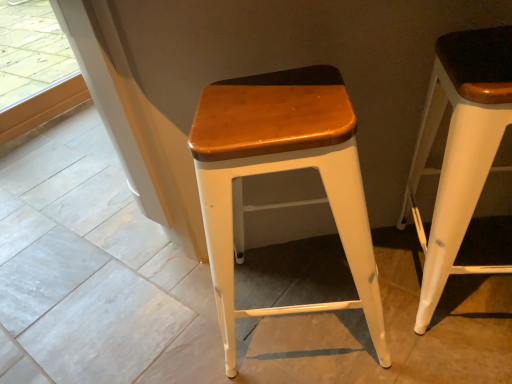
Where is `free space above wooden seat at center, the first stool from the left (from a real-world perspective)`? The width and height of the screenshot is (512, 384). free space above wooden seat at center, the first stool from the left (from a real-world perspective) is located at coordinates (270, 101).